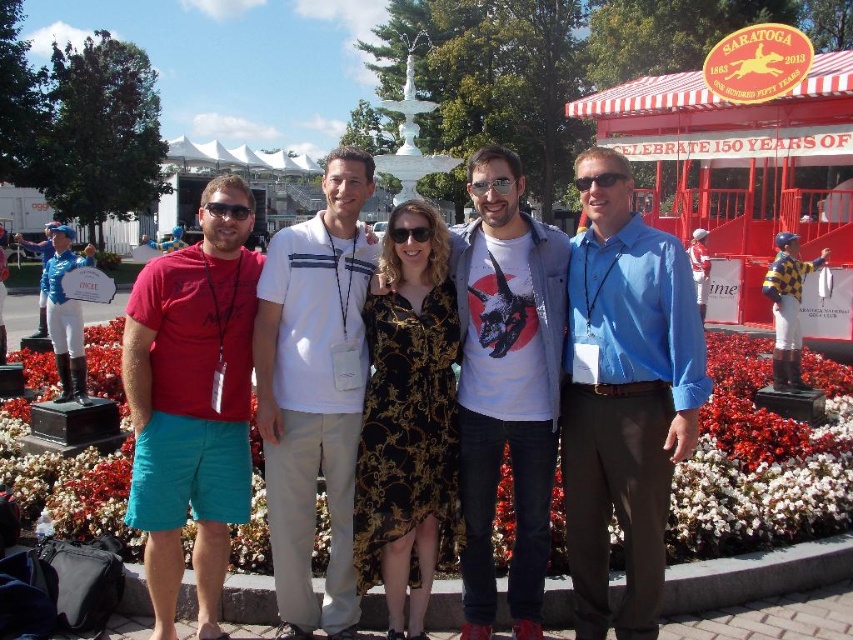
You are standing at the point marked by the coordinates point (624, 400). Looking around, you see the blue shirt at center. Which direction should you face to see the woman in the black dress adorned with gold?

The blue shirt at center is located at point (624, 400). Since the woman in the black dress adorned with gold is in the center, facing forward would allow you to see her.

You are a photographer trying to capture a clear shot of both the matte black glasses at center and the black plastic sunglasses at center. Which object should you focus on first if you want to ensure both are in focus, considering their sizes?

The matte black glasses at center is not as tall as black plastic sunglasses at center, so you should focus on the larger object first to ensure both are in focus.